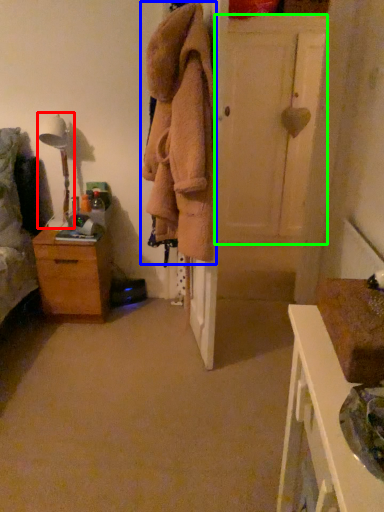
Question: Which object is positioned farthest from table lamp (highlighted by a red box)? Select from clothing (highlighted by a blue box) and door (highlighted by a green box).

Choices:
 (A) clothing
 (B) door

Answer: (B)